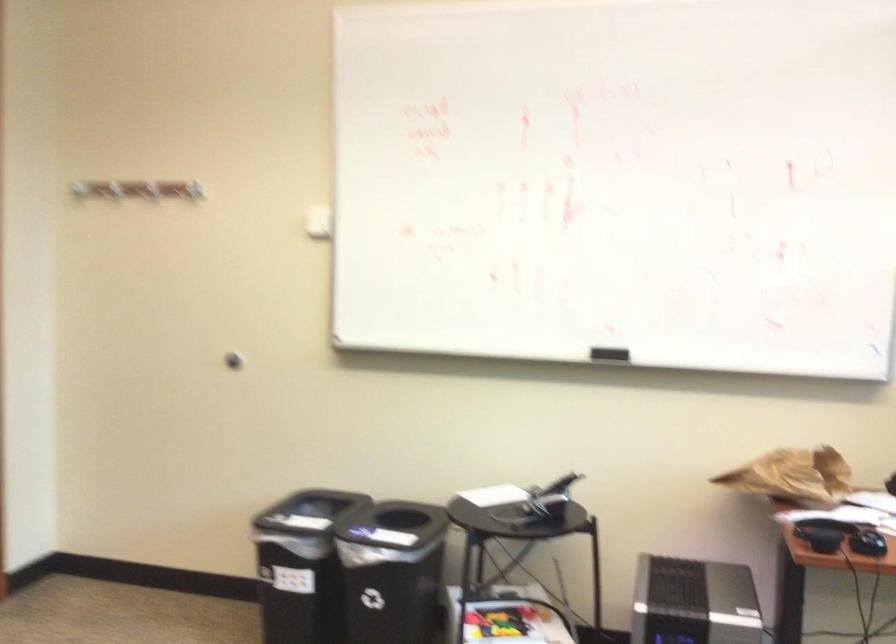
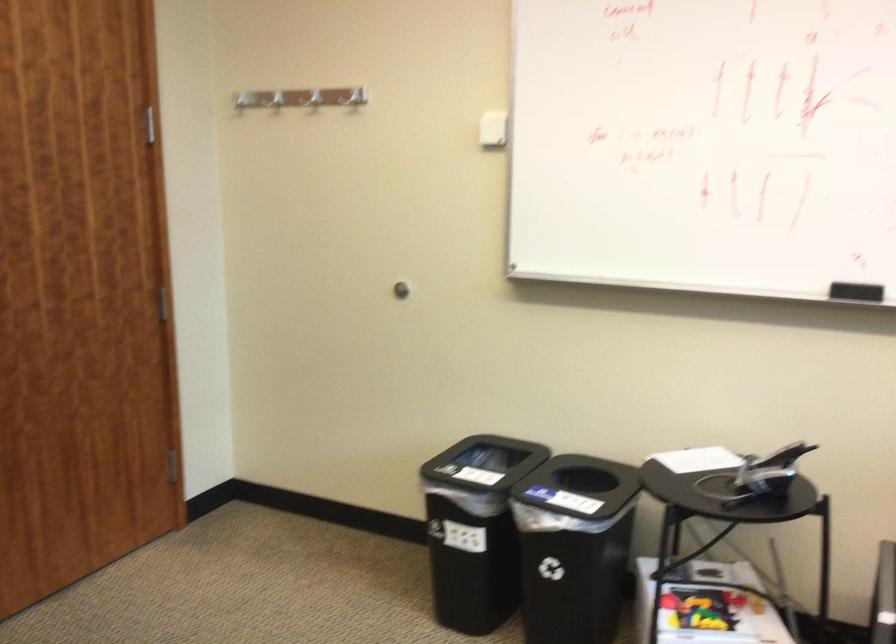
The point at (113,181) is marked in the first image. Where is the corresponding point in the second image?

(277, 99)